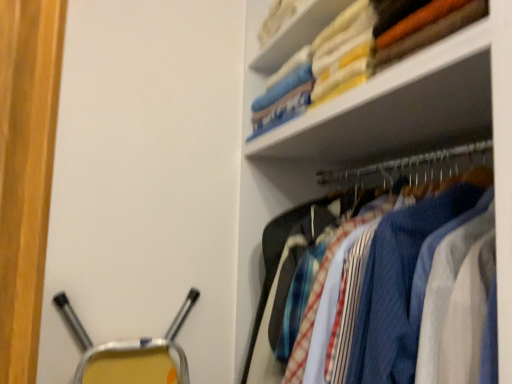
Question: From a real-world perspective, is white fabric at upper right positioned under textured fabric shirts at upper right based on gravity?

Choices:
 (A) yes
 (B) no

Answer: (B)

Question: Is white fabric at upper right oriented away from textured fabric shirts at upper right?

Choices:
 (A) no
 (B) yes

Answer: (A)

Question: Would you consider white fabric at upper right to be distant from textured fabric shirts at upper right?

Choices:
 (A) no
 (B) yes

Answer: (A)

Question: From the image's perspective, would you say white fabric at upper right is shown under textured fabric shirts at upper right?

Choices:
 (A) yes
 (B) no

Answer: (B)

Question: Is white fabric at upper right not inside textured fabric shirts at upper right?

Choices:
 (A) no
 (B) yes

Answer: (B)

Question: Is soft cotton towels at upper right to the left or to the right of white fabric at upper right in the image?

Choices:
 (A) right
 (B) left

Answer: (A)

Question: Would you say soft cotton towels at upper right is inside or outside white fabric at upper right?

Choices:
 (A) inside
 (B) outside

Answer: (B)

Question: Considering their positions, is soft cotton towels at upper right located in front of or behind white fabric at upper right?

Choices:
 (A) behind
 (B) front

Answer: (B)

Question: Is point (473, 6) positioned closer to the camera than point (289, 44)?

Choices:
 (A) closer
 (B) farther

Answer: (A)

Question: In terms of height, does white fabric at upper right look taller or shorter compared to soft cotton towels at upper right?

Choices:
 (A) tall
 (B) short

Answer: (B)

Question: Is white fabric at upper right situated inside soft cotton towels at upper right or outside?

Choices:
 (A) inside
 (B) outside

Answer: (B)

Question: Would you say white fabric at upper right is to the left or to the right of soft cotton towels at upper right in the picture?

Choices:
 (A) right
 (B) left

Answer: (B)

Question: Considering the positions of white fabric at upper right and soft cotton towels at upper right in the image, is white fabric at upper right wider or thinner than soft cotton towels at upper right?

Choices:
 (A) wide
 (B) thin

Answer: (B)

Question: Choose the correct answer: Is textured fabric shirts at upper right inside soft cotton towels at upper right or outside it?

Choices:
 (A) inside
 (B) outside

Answer: (B)

Question: From a real-world perspective, is textured fabric shirts at upper right above or below soft cotton towels at upper right?

Choices:
 (A) below
 (B) above

Answer: (A)